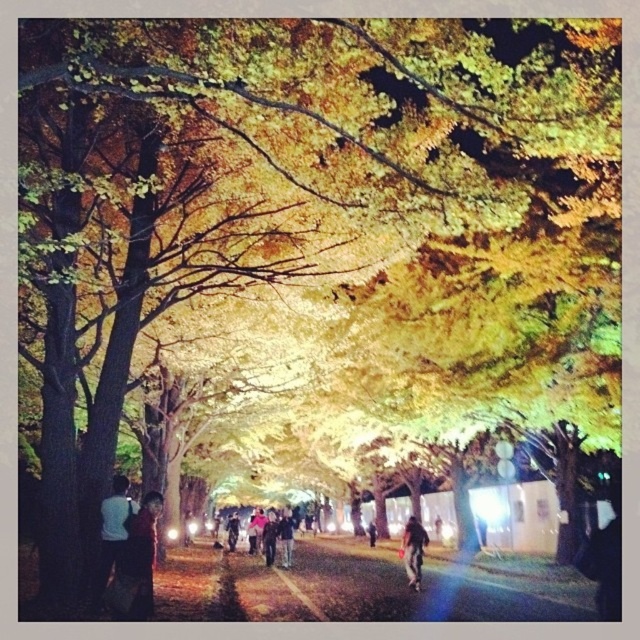
Question: Which point is farther to the camera?

Choices:
 (A) dark brown leather jacket at lower left
 (B) dark brown leather jacket at center
 (C) white matte shirt at lower left
 (D) dark gray sweater at center

Answer: (B)

Question: Estimate the real-world distances between objects in this image. Which object is closer to the shiny asphalt path at center?

Choices:
 (A) dark gray sweater at center
 (B) dark brown leather jacket at center

Answer: (A)

Question: Which object is farther from the camera taking this photo?

Choices:
 (A) white matte shirt at lower left
 (B) dark gray sweater at center
 (C) dark brown leather jacket at center

Answer: (C)

Question: Is shiny asphalt path at center to the right of white matte shirt at lower left from the viewer's perspective?

Choices:
 (A) yes
 (B) no

Answer: (A)

Question: Observing the image, what is the correct spatial positioning of dark brown leather jacket at lower left in reference to dark gray fabric jacket at center?

Choices:
 (A) below
 (B) above

Answer: (B)

Question: Can you confirm if white matte shirt at lower left is bigger than dark brown leather jacket at center?

Choices:
 (A) yes
 (B) no

Answer: (B)